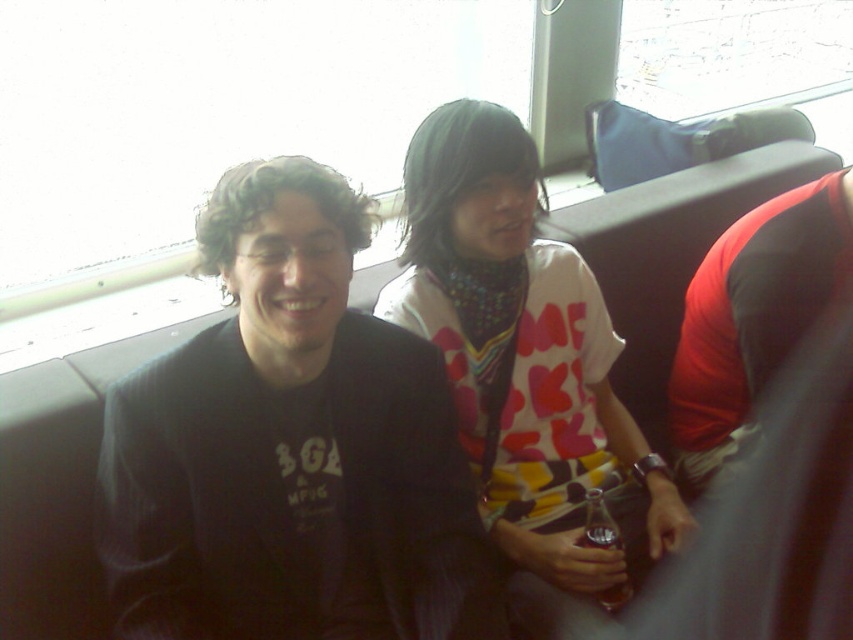
You are a photographer who wants to take a photo of the dark gray sweater at center and the printed cotton shirt at center. Which one is located to the left of the other?

The dark gray sweater at center is positioned on the left side of the printed cotton shirt at center.

You are a photographer trying to capture a clear photo of both the dark gray sweater at center and the printed cotton shirt at center. Since you can only focus on one object at a time, which one should you focus on to ensure the other is also somewhat in focus?

You should focus on the dark gray sweater at center because it is closer to the viewer than the printed cotton shirt at center, so focusing on the closer object will help keep the farther one in better focus.